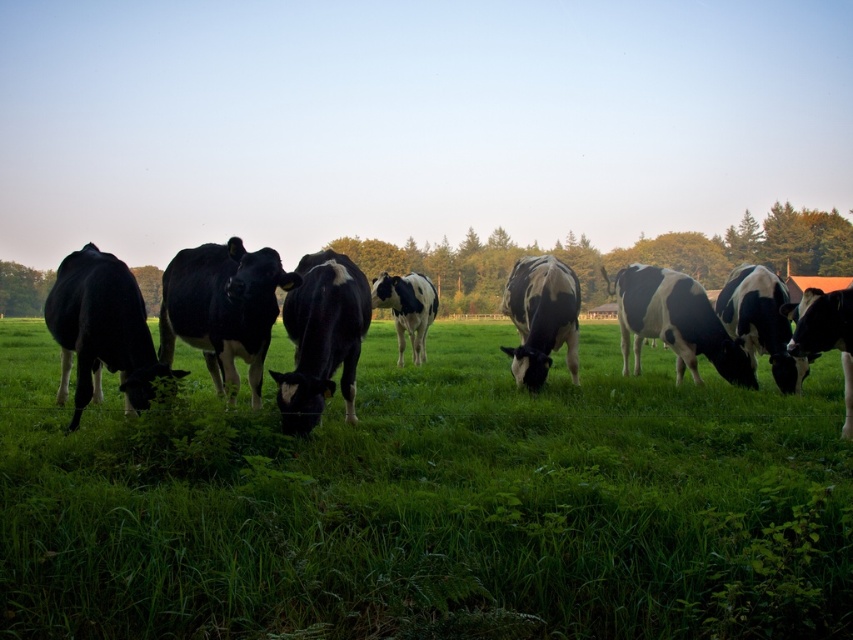
Does green grassy at center have a lesser height compared to black and white cow at left?

Incorrect, green grassy at center's height does not fall short of black and white cow at left's.

Between point (492, 432) and point (769, 272), which one is positioned in front?

Point (492, 432) is more forward.

Locate an element on the screen. green grassy at center is located at coordinates (428, 506).

Who is positioned more to the left, green grassy at center or black and white spotted cow at center?

green grassy at center is more to the left.

Which is behind, point (631, 604) or point (393, 300)?

The point (393, 300) is more distant.

Measure the distance between point (119, 440) and camera.

Point (119, 440) and camera are 11.89 feet apart.

The height and width of the screenshot is (640, 853). Find the location of `green grassy at center`. green grassy at center is located at coordinates (428, 506).

Can you confirm if black and white cow at left is smaller than black and white spotted cow at center?

Yes, black and white cow at left is smaller than black and white spotted cow at center.

Which is behind, point (251, 321) or point (419, 332)?

The point (419, 332) is behind.

Identify the location of black and white cow at left. (212, 323).